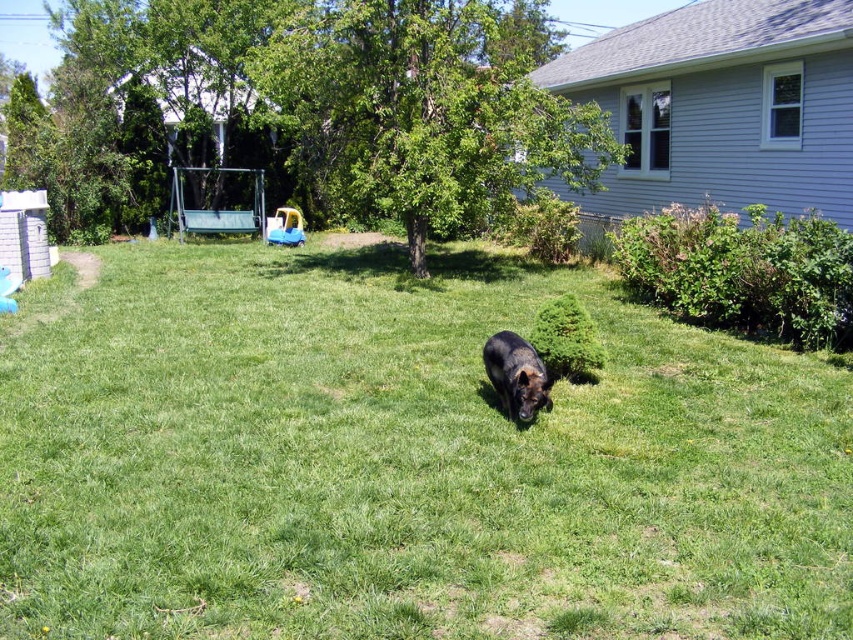
Question: Which point is closer to the camera?

Choices:
 (A) (514, 342)
 (B) (74, 563)

Answer: (B)

Question: Does green grassy at center appear under black fur dog at center?

Choices:
 (A) no
 (B) yes

Answer: (A)

Question: Which of the following is the closest to the observer?

Choices:
 (A) (546, 378)
 (B) (71, 284)

Answer: (A)

Question: Which point is farther to the camera?

Choices:
 (A) green grassy at center
 (B) black fur dog at center

Answer: (B)

Question: Does green grassy at center have a larger size compared to black fur dog at center?

Choices:
 (A) no
 (B) yes

Answer: (B)

Question: Is green grassy at center closer to the viewer compared to black fur dog at center?

Choices:
 (A) yes
 (B) no

Answer: (A)